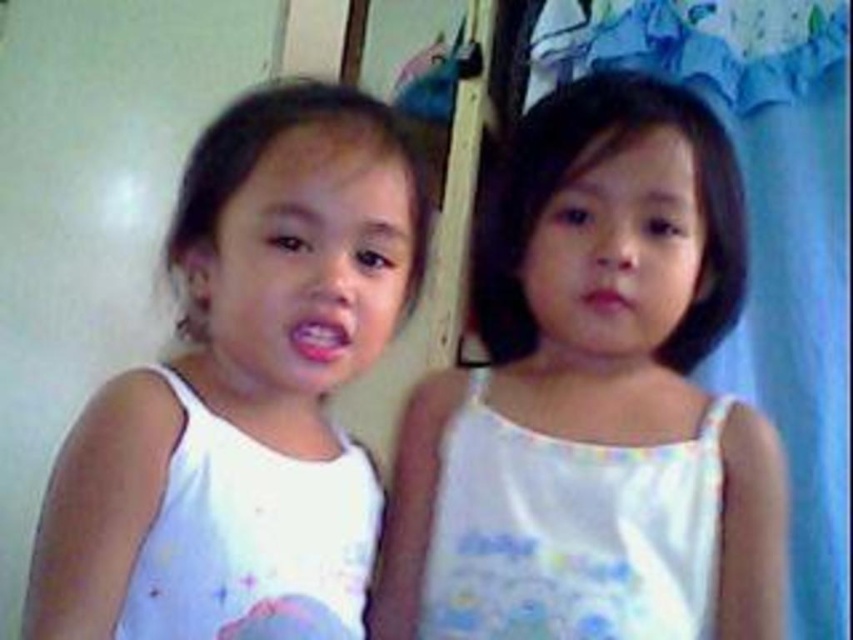
Question: Among these points, which one is farthest from the camera?

Choices:
 (A) (556, 106)
 (B) (299, 170)
 (C) (605, 289)
 (D) (308, 324)

Answer: (A)

Question: Which of the following is the closest to the observer?

Choices:
 (A) (181, 268)
 (B) (334, 348)
 (C) (622, 307)

Answer: (B)

Question: Is the position of pink glossy lips at center more distant than that of matte pink lips at center?

Choices:
 (A) yes
 (B) no

Answer: (B)

Question: Can you confirm if white fabric dress at center is positioned above pink glossy lips at center?

Choices:
 (A) yes
 (B) no

Answer: (B)

Question: Does white cotton tank top at left appear on the left side of pink glossy lips at center?

Choices:
 (A) no
 (B) yes

Answer: (B)

Question: Among these points, which one is farthest from the camera?

Choices:
 (A) (222, 246)
 (B) (616, 298)
 (C) (323, 337)
 (D) (389, 548)

Answer: (D)